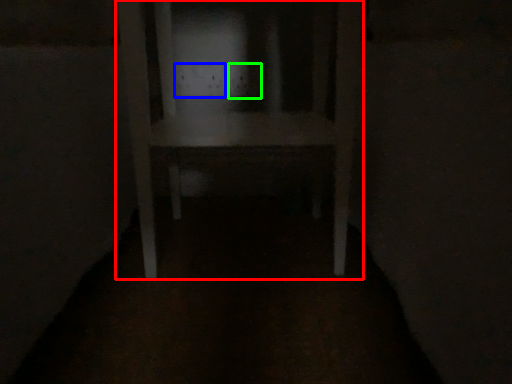
Question: Estimate the real-world distances between objects in this image. Which object is farther from furniture (highlighted by a red box), electric outlet (highlighted by a blue box) or electric outlet (highlighted by a green box)?

Choices:
 (A) electric outlet
 (B) electric outlet

Answer: (B)